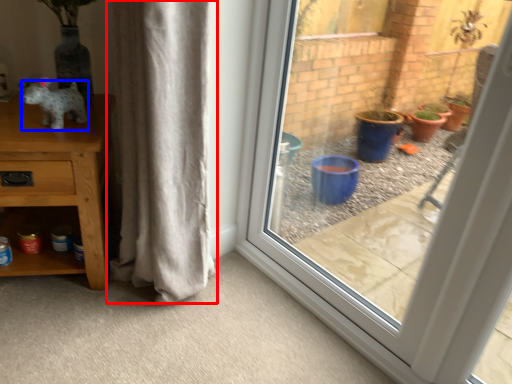
Question: Which of the following is the farthest to the observer, curtain (highlighted by a red box) or animal (highlighted by a blue box)?

Choices:
 (A) curtain
 (B) animal

Answer: (B)